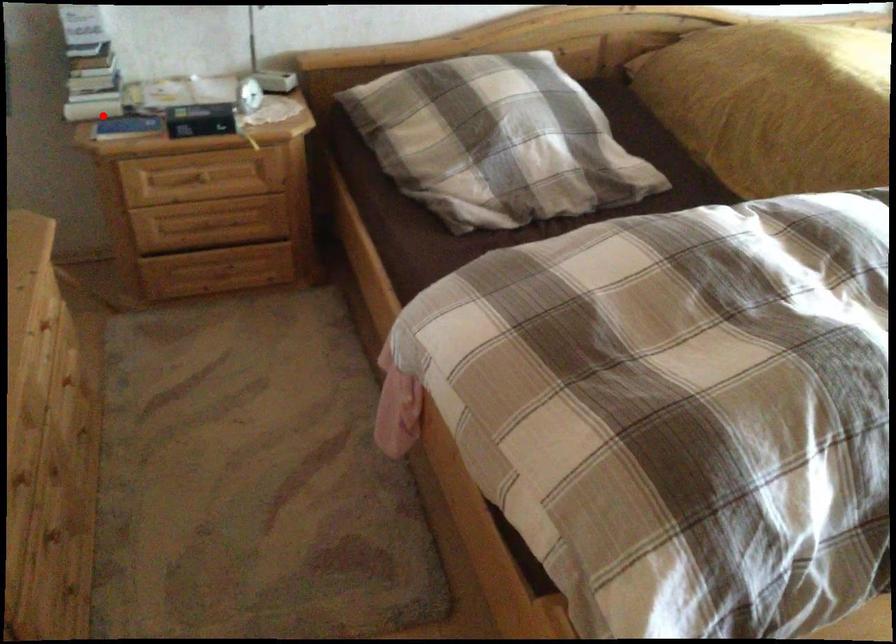
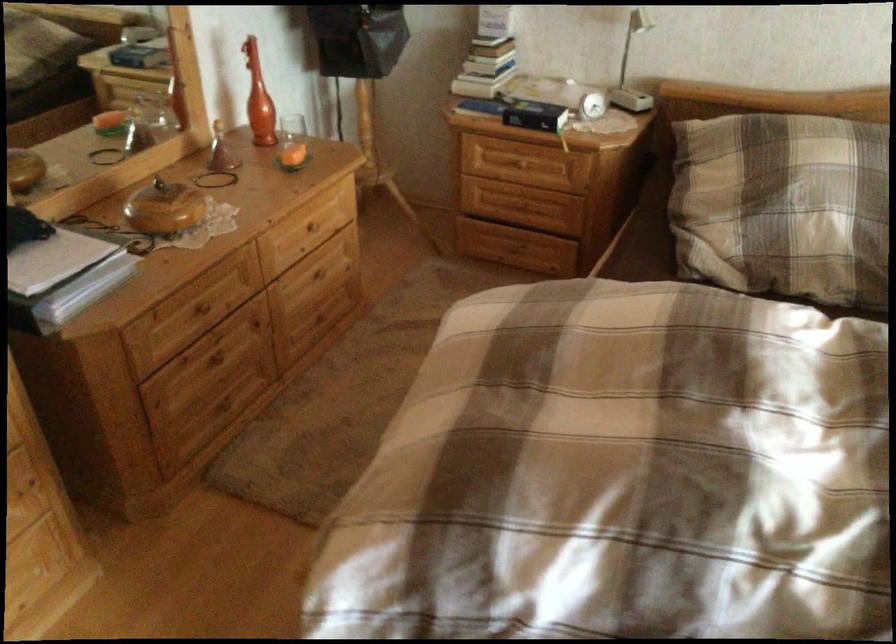
The point at the highlighted location is marked in the first image. Where is the corresponding point in the second image?

(474, 86)